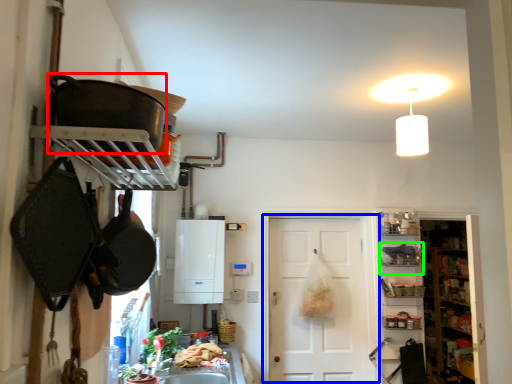
Question: Considering the real-world distances, which object is farthest from frying pan (highlighted by a red box)? door (highlighted by a blue box) or shelf (highlighted by a green box)?

Choices:
 (A) door
 (B) shelf

Answer: (B)